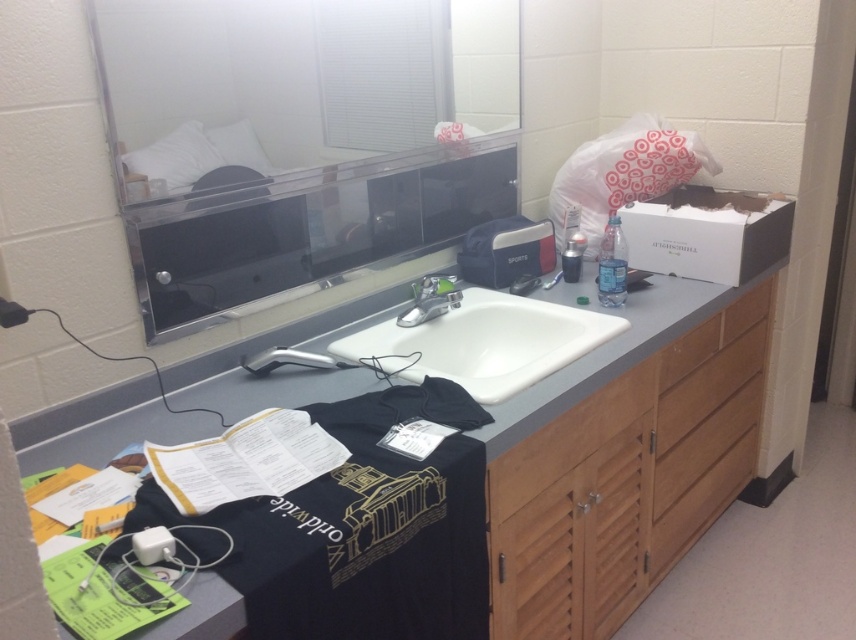
Does white ceramic sink at center have a greater width compared to translucent plastic bottle at sink?

Correct, the width of white ceramic sink at center exceeds that of translucent plastic bottle at sink.

Between point (419, 371) and point (574, 244), which one is positioned behind?

Positioned behind is point (574, 244).

The image size is (856, 640). I want to click on white ceramic sink at center, so click(x=484, y=342).

Between wooden at lower right and translucent plastic bottle at sink, which one appears on the right side from the viewer's perspective?

Positioned to the right is translucent plastic bottle at sink.

Is wooden at lower right thinner than translucent plastic bottle at sink?

No, wooden at lower right is not thinner than translucent plastic bottle at sink.

Which is in front, point (516, 496) or point (575, 260)?

Positioned in front is point (516, 496).

At what (x,y) coordinates should I click in order to perform the action: click on wooden at lower right. Please return your answer as a coordinate pair (x, y). The width and height of the screenshot is (856, 640). Looking at the image, I should click on (568, 440).

Which is behind, point (194, 289) or point (598, 401)?

Positioned behind is point (598, 401).

Is clear glass mirror at upper center thinner than wooden at lower right?

No.

Between point (342, 1) and point (586, 429), which one is positioned in front?

Positioned in front is point (586, 429).

This screenshot has width=856, height=640. Identify the location of clear glass mirror at upper center. (288, 141).